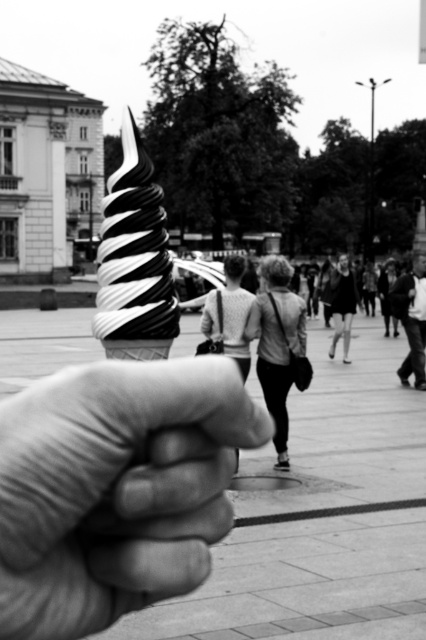
Question: Which object appears farthest from the camera in this image?

Choices:
 (A) black and white swirl ice cream at center
 (B) smooth skin hand at center
 (C) smooth gray jacket at center
 (D) dark gray fabric jacket at center

Answer: (D)

Question: Can you confirm if smooth gray jacket at center is positioned to the right of dark gray fabric jacket at center?

Choices:
 (A) yes
 (B) no

Answer: (B)

Question: Which object is the farthest from the smooth gray jacket at center?

Choices:
 (A) smooth skin hand at center
 (B) dark gray fabric jacket at center

Answer: (B)

Question: From the image, what is the correct spatial relationship of black and white swirl ice cream at center in relation to dark gray fabric jacket at center?

Choices:
 (A) left
 (B) right

Answer: (A)

Question: Is smooth skin hand at center smaller than dark gray fabric jacket at center?

Choices:
 (A) no
 (B) yes

Answer: (B)

Question: Which object appears closest to the camera in this image?

Choices:
 (A) dark gray fabric jacket at center
 (B) smooth gray jacket at center
 (C) smooth skin hand at center

Answer: (C)